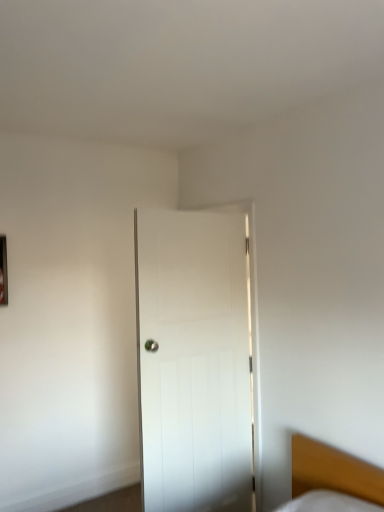
Question: Is white wooden door at center far from metallic rectangular frame at left?

Choices:
 (A) yes
 (B) no

Answer: (A)

Question: Considering the relative positions of white wooden door at center and metallic rectangular frame at left in the image provided, is white wooden door at center behind metallic rectangular frame at left?

Choices:
 (A) no
 (B) yes

Answer: (A)

Question: Is white wooden door at center facing towards metallic rectangular frame at left?

Choices:
 (A) yes
 (B) no

Answer: (B)

Question: From a real-world perspective, is white wooden door at center positioned under metallic rectangular frame at left based on gravity?

Choices:
 (A) yes
 (B) no

Answer: (A)

Question: Is white wooden door at center outside of metallic rectangular frame at left?

Choices:
 (A) yes
 (B) no

Answer: (A)

Question: Does white wooden door at center have a greater width compared to metallic rectangular frame at left?

Choices:
 (A) no
 (B) yes

Answer: (B)

Question: Is metallic rectangular frame at left bigger than wooden bed at lower right?

Choices:
 (A) yes
 (B) no

Answer: (B)

Question: Is metallic rectangular frame at left facing away from wooden bed at lower right?

Choices:
 (A) no
 (B) yes

Answer: (A)

Question: Does metallic rectangular frame at left have a lesser height compared to wooden bed at lower right?

Choices:
 (A) yes
 (B) no

Answer: (B)

Question: Is metallic rectangular frame at left located outside wooden bed at lower right?

Choices:
 (A) yes
 (B) no

Answer: (A)

Question: From the image's perspective, would you say metallic rectangular frame at left is shown under wooden bed at lower right?

Choices:
 (A) no
 (B) yes

Answer: (A)

Question: Does metallic rectangular frame at left contain wooden bed at lower right?

Choices:
 (A) yes
 (B) no

Answer: (B)

Question: Is wooden bed at lower right behind metallic rectangular frame at left?

Choices:
 (A) yes
 (B) no

Answer: (B)